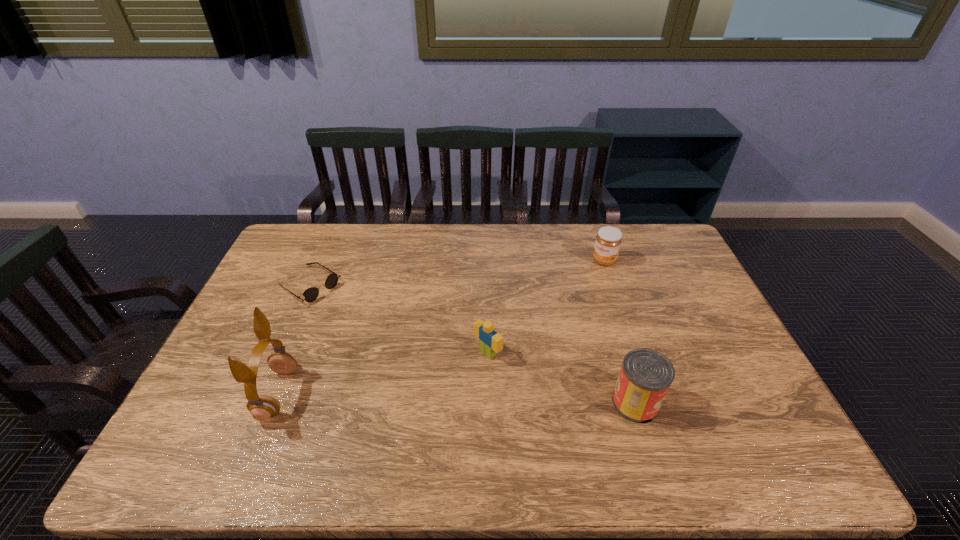
At what (x,y) coordinates should I click in order to perform the action: click on free space located 0.120m on the face of the third object from left to right. Please return your answer as a coordinate pair (x, y). This screenshot has width=960, height=540. Looking at the image, I should click on (444, 386).

Locate an element on the screen. Image resolution: width=960 pixels, height=540 pixels. vacant space situated 0.060m on the face of the third object from left to right is located at coordinates (462, 373).

The image size is (960, 540). I want to click on blank space located on the front label of the jam, so click(x=567, y=302).

This screenshot has height=540, width=960. In order to click on vacant space located 0.140m on the front label of the jam in this screenshot , I will do `click(580, 288)`.

Image resolution: width=960 pixels, height=540 pixels. Identify the location of blank area located 0.260m on the front label of the jam. (561, 309).

Find the location of a particular element. The width and height of the screenshot is (960, 540). vacant area located on the front-facing side of the sunglasses is located at coordinates (360, 318).

Image resolution: width=960 pixels, height=540 pixels. I want to click on free point located on the front-facing side of the sunglasses, so click(405, 346).

Where is `free space located 0.140m on the front-facing side of the sunglasses`? This screenshot has width=960, height=540. free space located 0.140m on the front-facing side of the sunglasses is located at coordinates (360, 318).

I want to click on object that is at the far edge, so click(x=608, y=240).

Find the location of a particular element. This screenshot has width=960, height=540. earphone that is at the near edge is located at coordinates (262, 407).